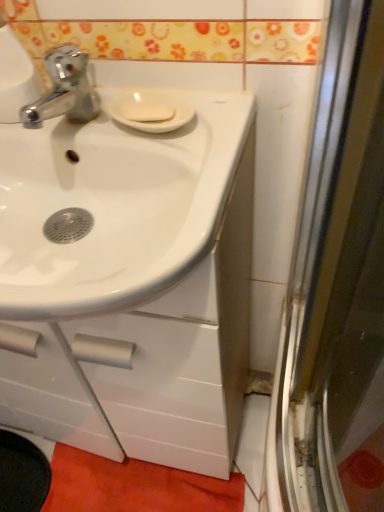
Question: Relative to white matte soap at center, is orange fabric bath mat at lower center in front or behind?

Choices:
 (A) front
 (B) behind

Answer: (B)

Question: Visually, is orange fabric bath mat at lower center positioned to the left or to the right of white matte soap at center?

Choices:
 (A) left
 (B) right

Answer: (A)

Question: Estimate the real-world distances between objects in this image. Which object is farther from the white matte soap at center?

Choices:
 (A) white glossy sink at center
 (B) orange fabric bath mat at lower center

Answer: (B)

Question: Estimate the real-world distances between objects in this image. Which object is farther from the orange fabric bath mat at lower center?

Choices:
 (A) white glossy sink at center
 (B) white matte soap at center

Answer: (B)